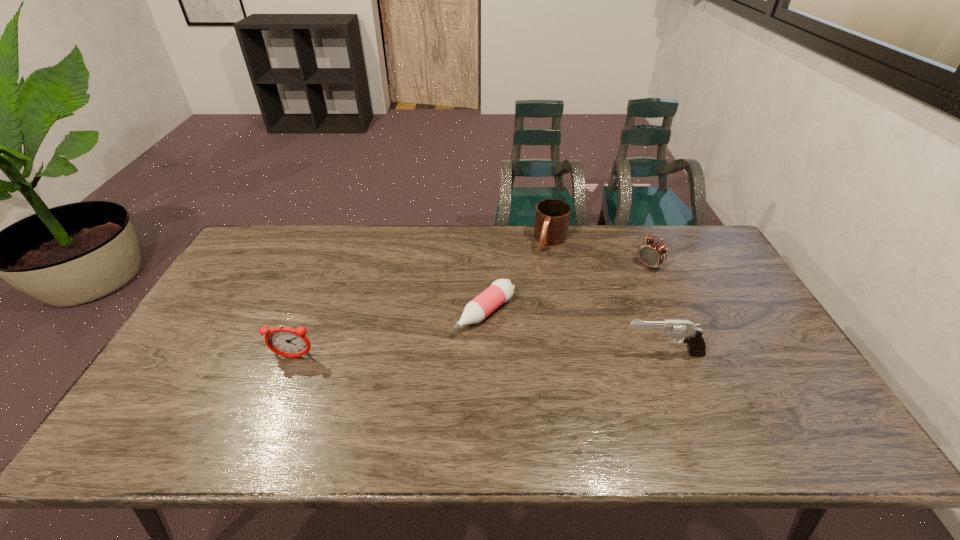
Find the location of a particular element. The height and width of the screenshot is (540, 960). vacant space located 0.210m at the muzzle of the gun is located at coordinates (543, 353).

At what (x,y) coordinates should I click in order to perform the action: click on free space located at the muzzle of the gun. Please return your answer as a coordinate pair (x, y). The height and width of the screenshot is (540, 960). Looking at the image, I should click on (604, 353).

The height and width of the screenshot is (540, 960). I want to click on free space located at the muzzle of the gun, so click(495, 353).

Find the location of a particular element. free space located 0.240m with the cap open on the fourth object from right to left is located at coordinates (398, 385).

Where is `vacant region located with the cap open on the fourth object from right to left`? Image resolution: width=960 pixels, height=540 pixels. vacant region located with the cap open on the fourth object from right to left is located at coordinates (425, 363).

Locate an element on the screen. free region located with the cap open on the fourth object from right to left is located at coordinates (434, 357).

The width and height of the screenshot is (960, 540). I want to click on free space located on the side of the farthest object with the handle, so click(523, 304).

In order to click on free region located 0.200m on the side of the farthest object with the handle in this screenshot , I will do point(529,292).

You are a GUI agent. You are given a task and a screenshot of the screen. Output one action in this format:
    pyautogui.click(x=<x>, y=<y>)
    Task: Click on the vacant space located 0.360m on the side of the farthest object with the handle
    This screenshot has width=960, height=540.
    Given the screenshot: What is the action you would take?
    pyautogui.click(x=512, y=327)

This screenshot has width=960, height=540. Find the location of `vacant area situated on the face of the second farthest object`. vacant area situated on the face of the second farthest object is located at coordinates (592, 308).